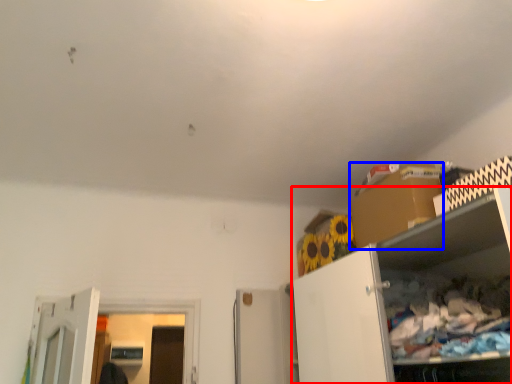
Question: Which object appears closest to the camera in this image, cabinetry (highlighted by a red box) or cardboard box (highlighted by a blue box)?

Choices:
 (A) cabinetry
 (B) cardboard box

Answer: (A)